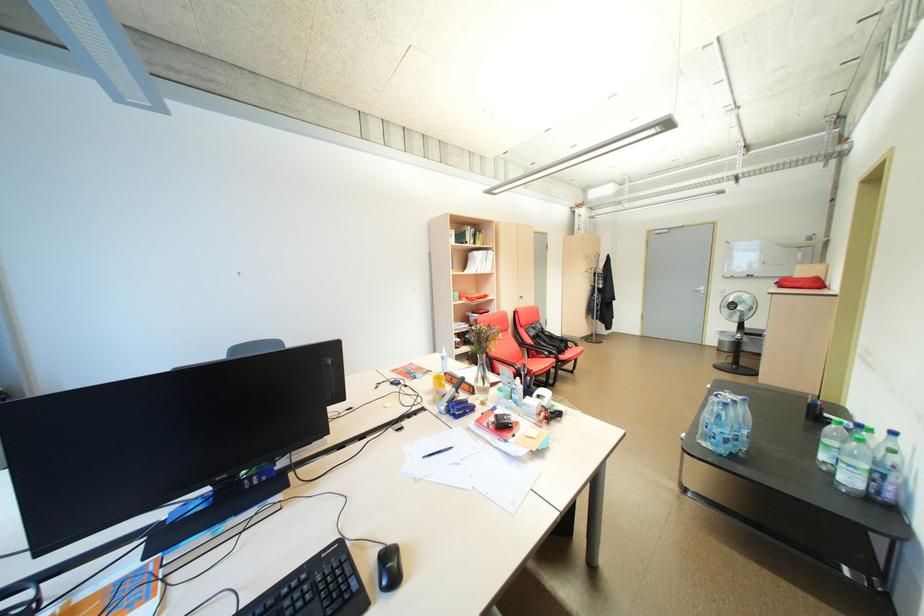
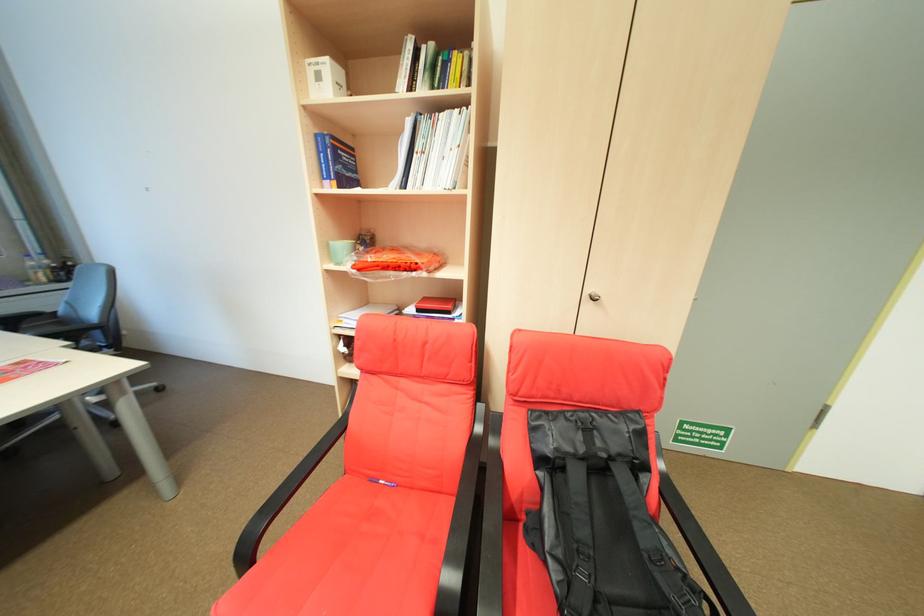
Where in the second image is the point corresponding to (x=541, y=339) from the first image?

(549, 461)